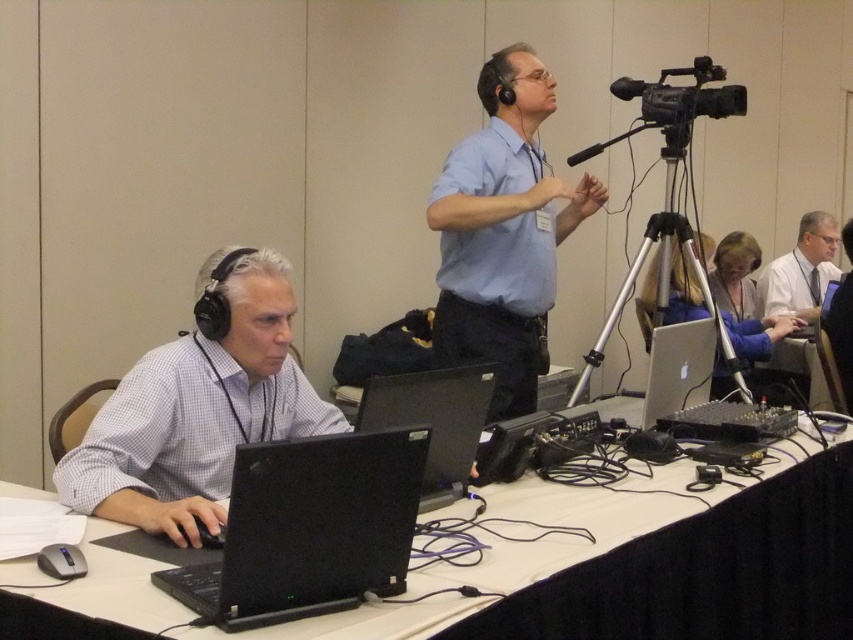
Does black plastic table at lower left have a larger size compared to light blue shirt at center?

Indeed, black plastic table at lower left has a larger size compared to light blue shirt at center.

Who is shorter, black plastic table at lower left or light blue shirt at center?

black plastic table at lower left

The height and width of the screenshot is (640, 853). Identify the location of black plastic table at lower left. (570, 525).

Between black matte laptop at lower left and black matte laptop at center, which one appears on the left side from the viewer's perspective?

black matte laptop at lower left is more to the left.

Is point (312, 445) in front of point (424, 408)?

Yes, point (312, 445) is closer to viewer.

Between point (300, 442) and point (445, 502), which one is positioned behind?

Positioned behind is point (445, 502).

At what (x,y) coordinates should I click in order to perform the action: click on black matte laptop at lower left. Please return your answer as a coordinate pair (x, y). This screenshot has height=640, width=853. Looking at the image, I should click on (308, 529).

You are a GUI agent. You are given a task and a screenshot of the screen. Output one action in this format:
    pyautogui.click(x=<x>, y=<y>)
    Task: Click on the matte black laptop at left
    This screenshot has width=853, height=640.
    Given the screenshot: What is the action you would take?
    pyautogui.click(x=198, y=406)